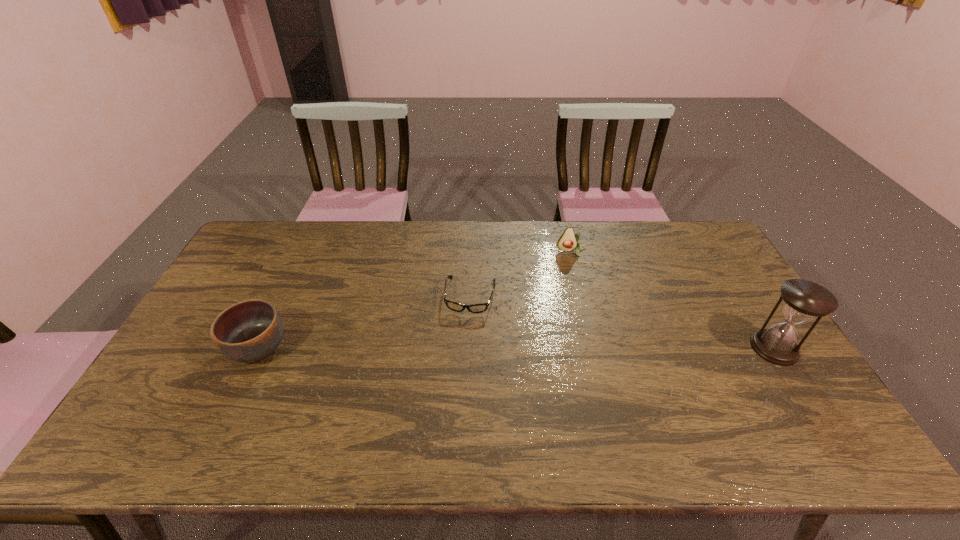
Identify the location of the leftmost object. Image resolution: width=960 pixels, height=540 pixels. pyautogui.click(x=248, y=331).

Image resolution: width=960 pixels, height=540 pixels. In order to click on the rightmost object in this screenshot , I will do `click(804, 300)`.

Find the location of `the tallest object`. the tallest object is located at coordinates (804, 300).

Where is `spectacles`? The image size is (960, 540). spectacles is located at coordinates (475, 308).

You are a GUI agent. You are given a task and a screenshot of the screen. Output one action in this format:
    pyautogui.click(x=<x>, y=<y>)
    Task: Click on the shortest object
    The height and width of the screenshot is (540, 960).
    Given the screenshot: What is the action you would take?
    pyautogui.click(x=475, y=308)

Image resolution: width=960 pixels, height=540 pixels. What are the coordinates of `the farthest object` in the screenshot? It's located at (568, 241).

Where is `the third object from left to right`? This screenshot has width=960, height=540. the third object from left to right is located at coordinates (568, 241).

The height and width of the screenshot is (540, 960). Find the location of `free space located on the right of the leftmost object`. free space located on the right of the leftmost object is located at coordinates coord(371,348).

Identify the location of vacant space located 0.060m on the left of the rightmost object. The width and height of the screenshot is (960, 540). (731, 348).

Locate an element on the screen. vacant region located 0.200m on the front-facing side of the shortest object is located at coordinates (457, 371).